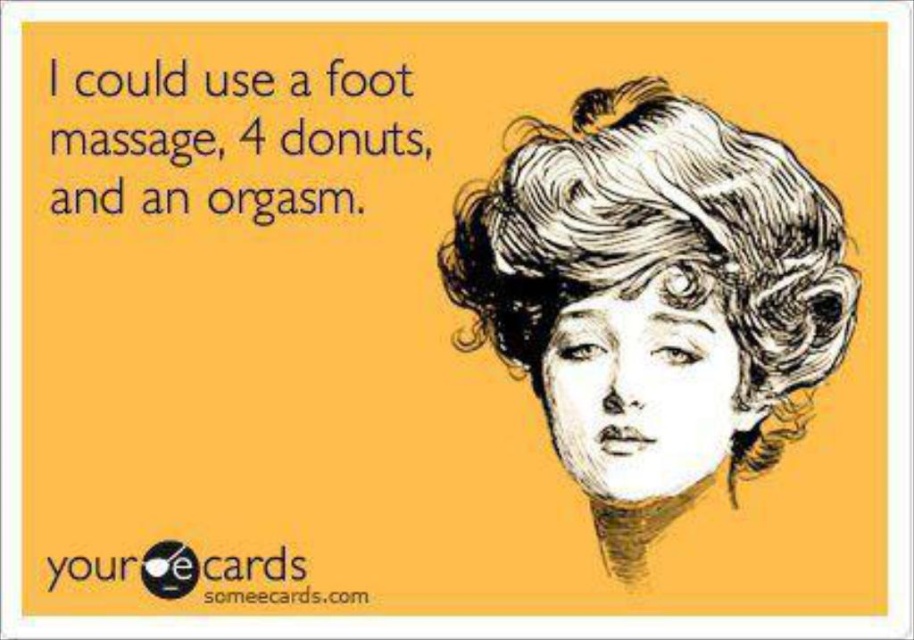
Question: Does white textured hair at upper right appear over black logo at upper center?

Choices:
 (A) yes
 (B) no

Answer: (A)

Question: Which point appears closest to the camera in this image?

Choices:
 (A) (219, 564)
 (B) (644, 189)

Answer: (B)

Question: Based on their relative distances, which object is nearer to the black logo at upper center?

Choices:
 (A) white textured hair at upper right
 (B) black text at upper left

Answer: (B)

Question: In this image, where is black text at upper left located relative to black logo at upper center?

Choices:
 (A) right
 (B) left

Answer: (A)

Question: Which object is closer to the camera taking this photo?

Choices:
 (A) white textured hair at upper right
 (B) black text at upper left

Answer: (A)

Question: Does black text at upper left appear on the left side of black logo at upper center?

Choices:
 (A) yes
 (B) no

Answer: (B)